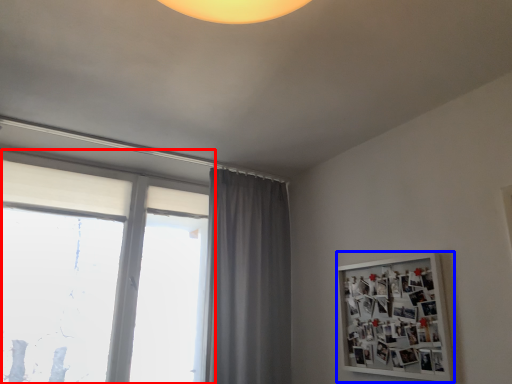
Question: Which point is further to the camera, window (highlighted by a red box) or bulletin board (highlighted by a blue box)?

Choices:
 (A) window
 (B) bulletin board

Answer: (A)